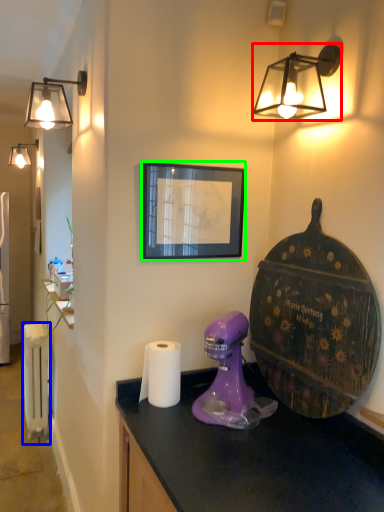
Question: Which is farther away from lamp (highlighted by a red box)? radiator (highlighted by a blue box) or picture frame (highlighted by a green box)?

Choices:
 (A) radiator
 (B) picture frame

Answer: (A)